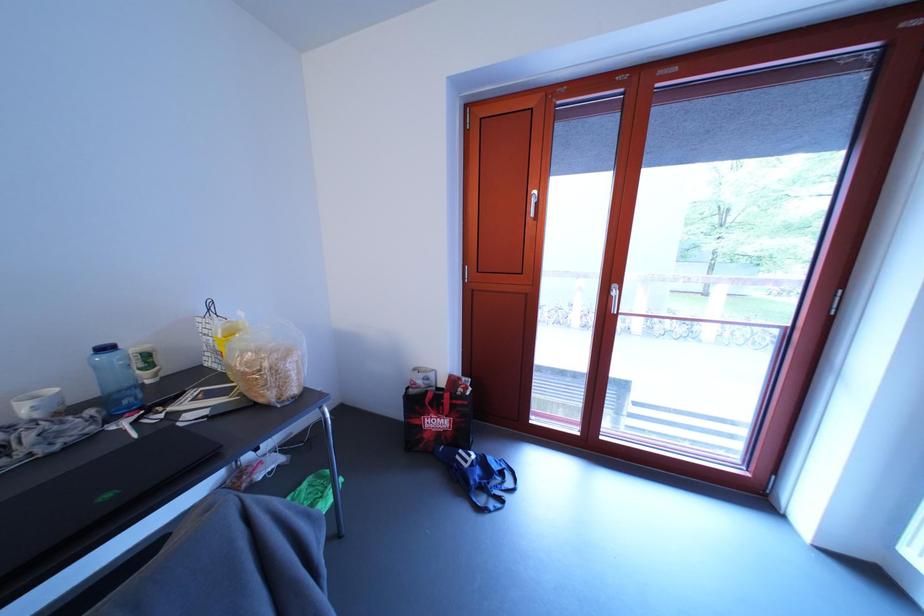
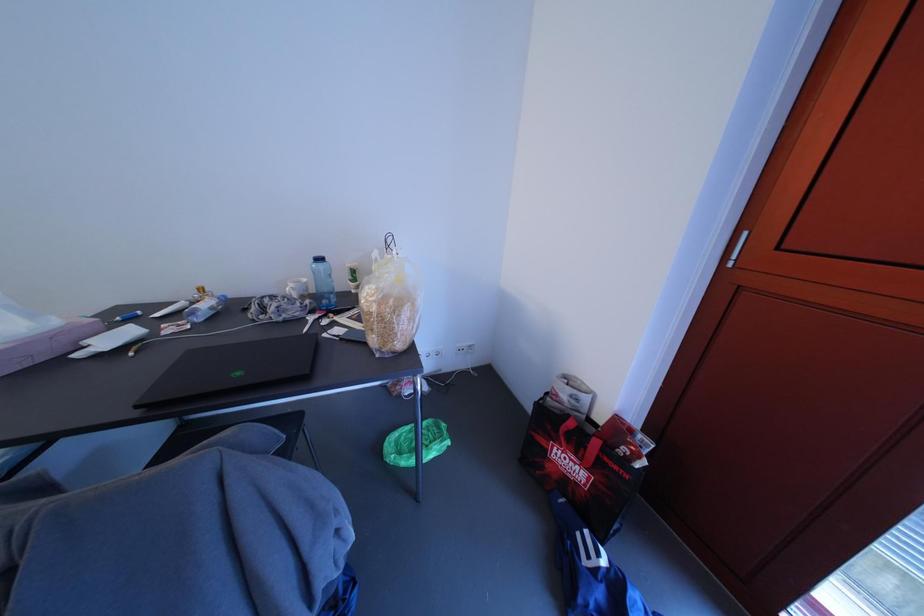
Question: The camera is either moving clockwise (left) or counter-clockwise (right) around the object. The first image is from the beginning of the video and the second image is from the end. Is the camera moving left or right when shooting the video?

Choices:
 (A) Left
 (B) Right

Answer: (B)